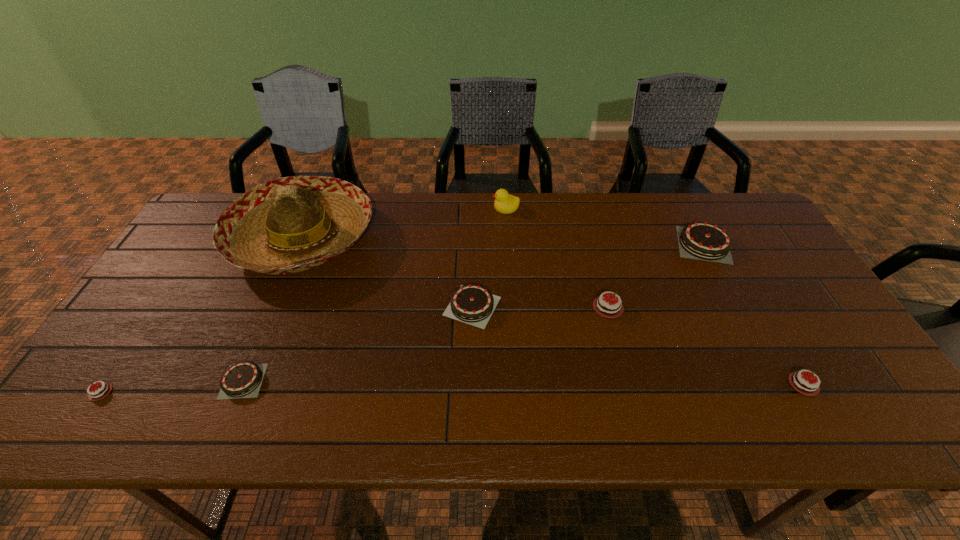
Image resolution: width=960 pixels, height=540 pixels. In order to click on the second smallest red chocolate cake in this screenshot , I will do `click(807, 385)`.

In order to click on the nearest brown chocolate cake in this screenshot , I will do `click(242, 380)`.

Identify the location of the fifth chocolate cake from right to left. (242, 380).

Where is `the shortest object`? The width and height of the screenshot is (960, 540). the shortest object is located at coordinates point(100,392).

Locate an element on the screen. The height and width of the screenshot is (540, 960). the leftmost chocolate cake is located at coordinates (100, 392).

In order to click on free point located on the front of the tallest object in this screenshot , I will do `click(272, 310)`.

This screenshot has height=540, width=960. What are the coordinates of `free location located on the face of the duckling` in the screenshot? It's located at (442, 207).

Where is `vacant position located 0.100m on the face of the duckling`? The width and height of the screenshot is (960, 540). vacant position located 0.100m on the face of the duckling is located at coordinates (462, 207).

Where is `vacant space located 0.210m on the face of the duckling`? vacant space located 0.210m on the face of the duckling is located at coordinates (429, 207).

At what (x,y) coordinates should I click in order to perform the action: click on vacant space located 0.250m on the left of the farthest chocolate cake. Please return your answer as a coordinate pair (x, y). This screenshot has height=540, width=960. Looking at the image, I should click on (593, 245).